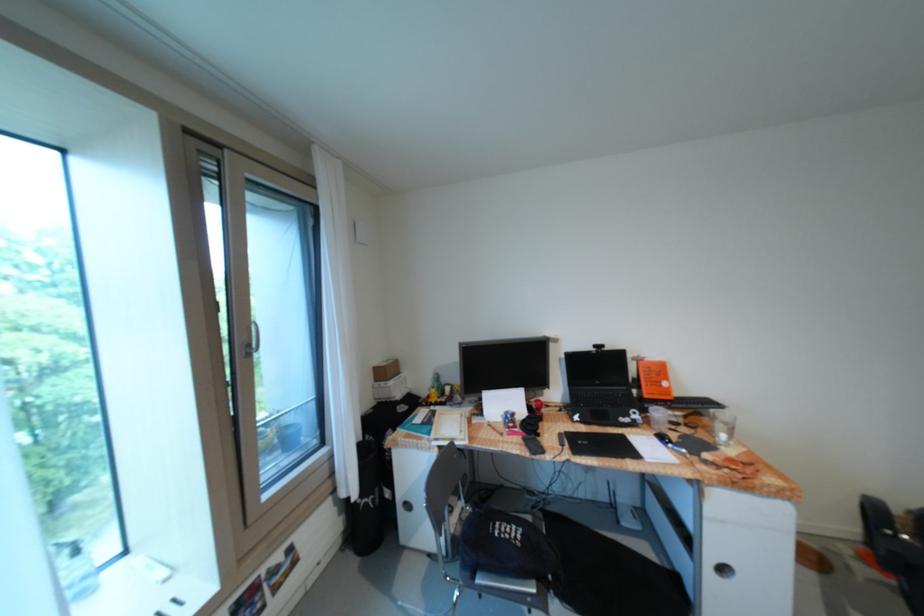
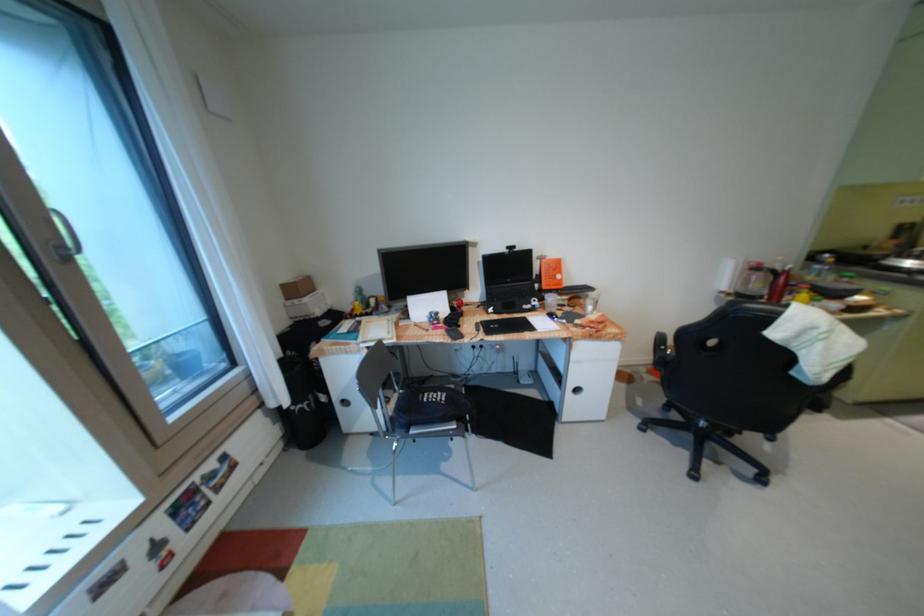
The images are taken continuously from a first-person perspective. In which direction is your viewpoint rotating?

The camera rotated toward right-down.